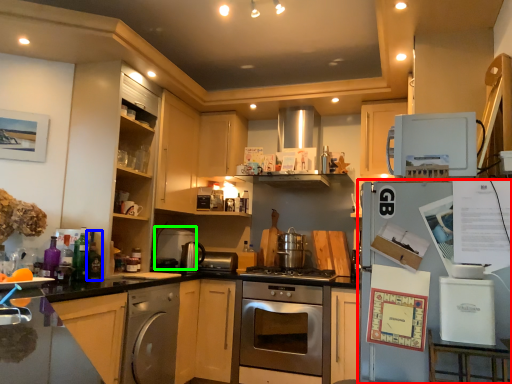
Question: Which object is positioned farthest from refrigerator (highlighted by a red box)? Select from bottle (highlighted by a blue box) and appliance (highlighted by a green box).

Choices:
 (A) bottle
 (B) appliance

Answer: (B)